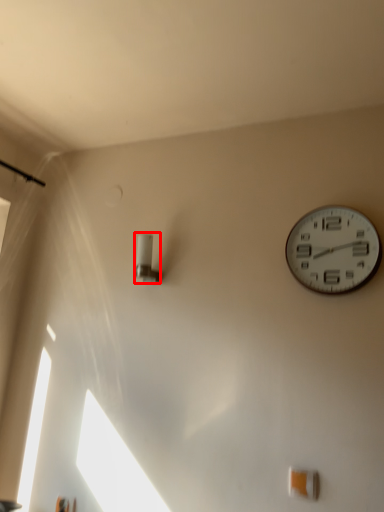
Question: From the image's perspective, where is light fixture (annotated by the red box) located in relation to wall clock in the image?

Choices:
 (A) below
 (B) above

Answer: (A)